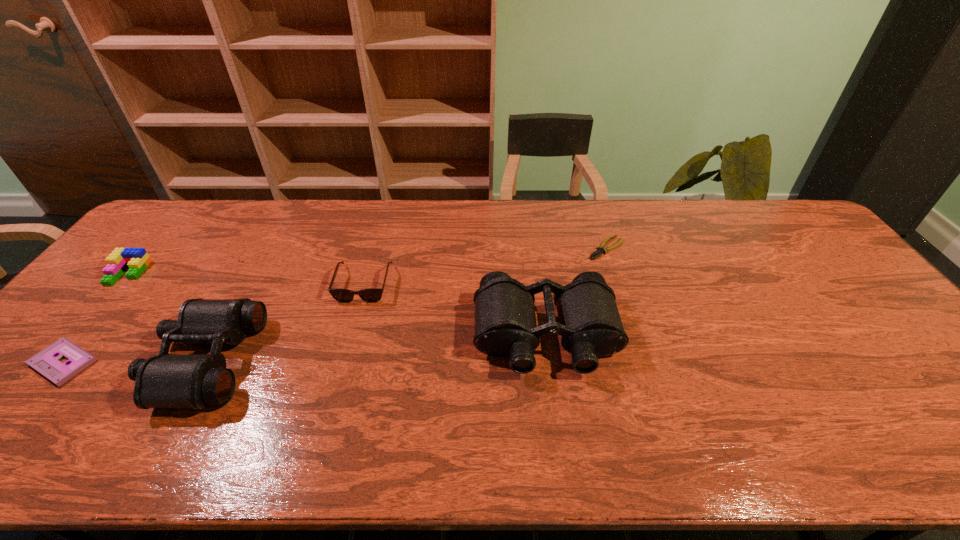
Where is `vacant area situated 0.140m through the eyepieces of the second tallest object`? vacant area situated 0.140m through the eyepieces of the second tallest object is located at coordinates (102, 360).

At what (x,y) coordinates should I click in order to perform the action: click on free space located through the eyepieces of the tallest object. Please return your answer as a coordinate pair (x, y). Image resolution: width=960 pixels, height=540 pixels. Looking at the image, I should click on (555, 399).

You are a GUI agent. You are given a task and a screenshot of the screen. Output one action in this format:
    pyautogui.click(x=<x>, y=<y>)
    Task: Click on the free region located 0.120m on the back of the pliers
    This screenshot has height=540, width=960.
    Given the screenshot: What is the action you would take?
    pyautogui.click(x=595, y=215)

Image resolution: width=960 pixels, height=540 pixels. Find the location of `blank space located at the front lenses of the sunglasses`. blank space located at the front lenses of the sunglasses is located at coordinates (334, 390).

Where is `vacant area situated on the right of the Lego`? This screenshot has width=960, height=540. vacant area situated on the right of the Lego is located at coordinates (219, 273).

This screenshot has width=960, height=540. In order to click on blank space located on the right of the videotape in this screenshot , I will do `click(222, 363)`.

Find the location of `object that is at the far edge`. object that is at the far edge is located at coordinates (601, 249).

The height and width of the screenshot is (540, 960). I want to click on binoculars located at the near edge, so click(197, 381).

You are a GUI agent. You are given a task and a screenshot of the screen. Output one action in this format:
    pyautogui.click(x=<x>, y=<y>)
    Task: Click on the videotape positioned at the near edge
    The width and height of the screenshot is (960, 540).
    Given the screenshot: What is the action you would take?
    pyautogui.click(x=46, y=362)

Find the location of a particular element. Image resolution: width=960 pixels, height=540 pixels. Lego that is at the left edge is located at coordinates (137, 259).